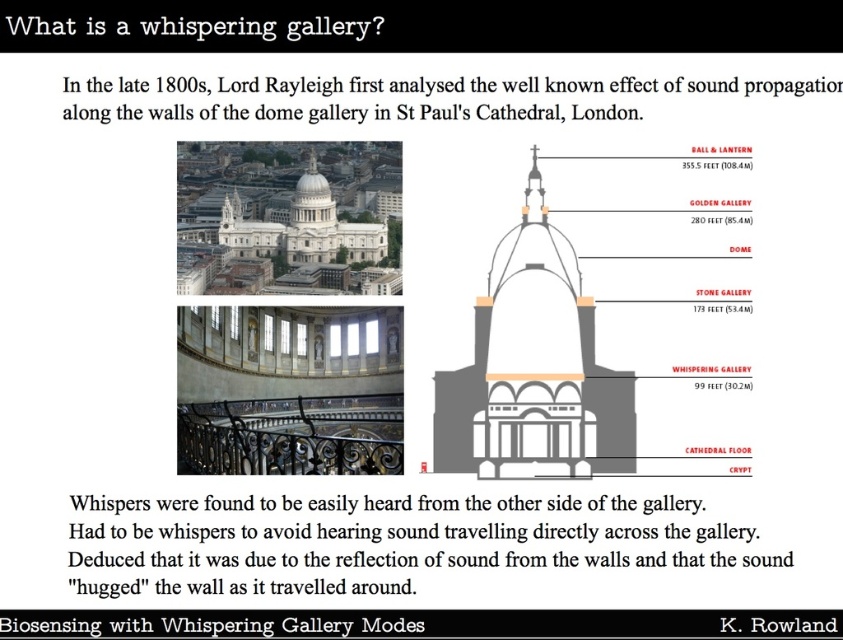
Is white stone dome at center shorter than white stone church at upper center?

Indeed, white stone dome at center has a lesser height compared to white stone church at upper center.

You are a GUI agent. You are given a task and a screenshot of the screen. Output one action in this format:
    pyautogui.click(x=<x>, y=<y>)
    Task: Click on the white stone dome at center
    
    Given the screenshot: What is the action you would take?
    pyautogui.click(x=534, y=369)